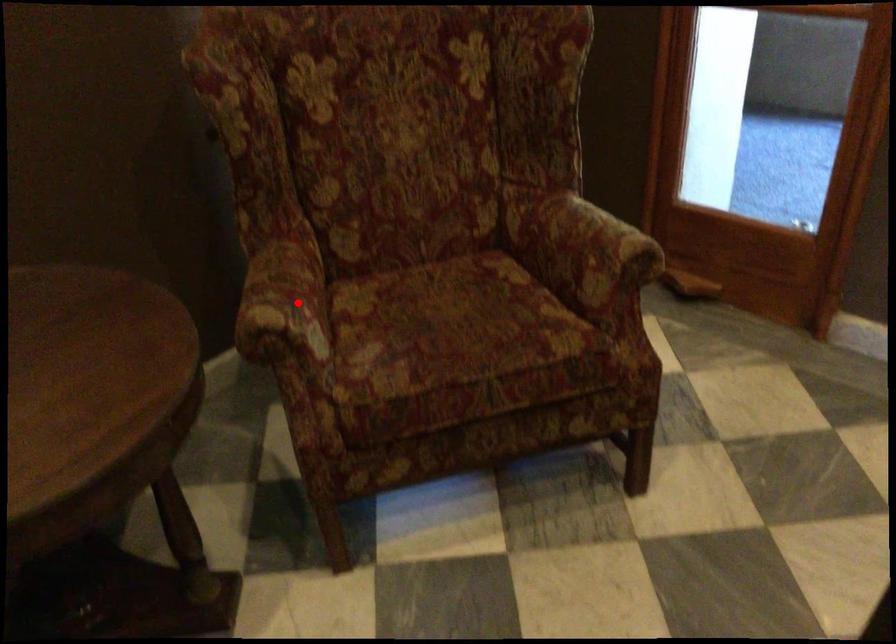
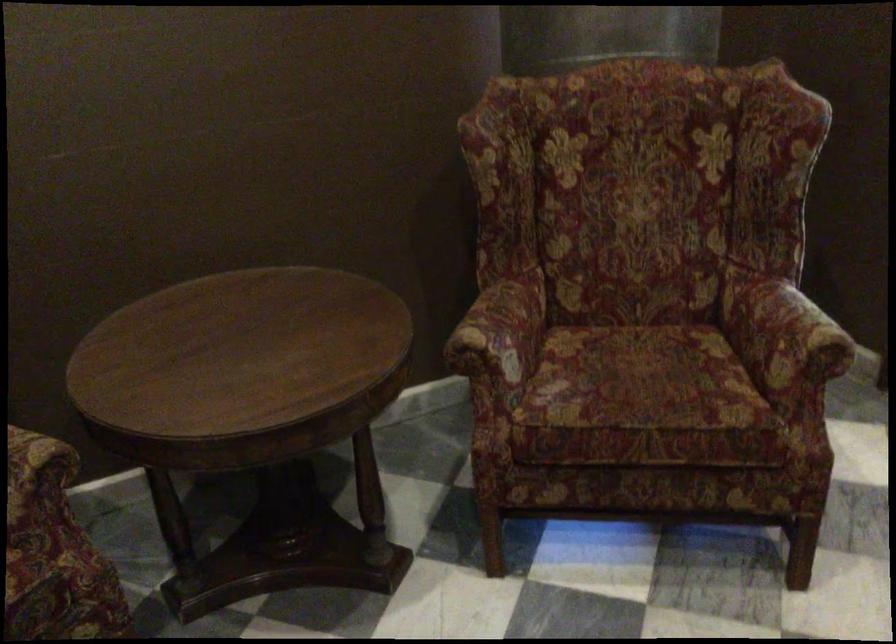
Question: I am providing you with two images of the same scene from different viewpoints. Image1 has a red point marked. In image2, the corresponding 3D location appears at what relative position? Reply with the corresponding letter.

Choices:
 (A) Closer
 (B) Farther

Answer: (B)